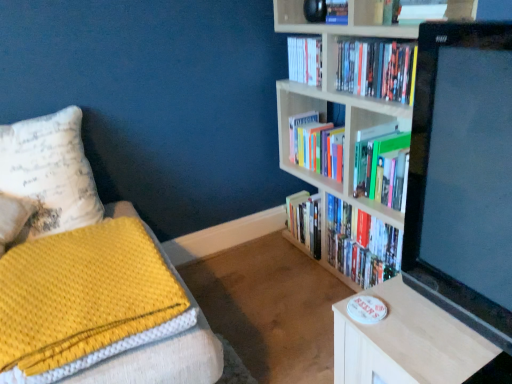
Question: Is hardcover books at upper right, which is the 3th book from back to front, wider or thinner than white paperback book at upper center, the 2th book in the back-to-front sequence?

Choices:
 (A) wide
 (B) thin

Answer: (B)

Question: Is point (382, 72) closer or farther from the camera than point (288, 41)?

Choices:
 (A) closer
 (B) farther

Answer: (A)

Question: Estimate the real-world distances between objects in this image. Which object is closer to the yellow textured blanket at lower left?

Choices:
 (A) white matte bookcase at upper right
 (B) hardcover books at upper right, the 2th book positioned from the front
 (C) light wood table at lower right
 (D) black glossy monitor at upper right
 (E) white paper at upper center, the 1th book in the front-to-back sequence

Answer: (C)

Question: Considering the real-world distances, which object is closest to the black glossy monitor at upper right?

Choices:
 (A) white paper at upper center, which appears as the 4th book when viewed from the back
 (B) white matte bookcase at upper right
 (C) light wood table at lower right
 (D) hardcover books at center, which ranks as the fourth book in front-to-back order
 (E) hardcover books at upper right, which is the 3th book from back to front

Answer: (C)